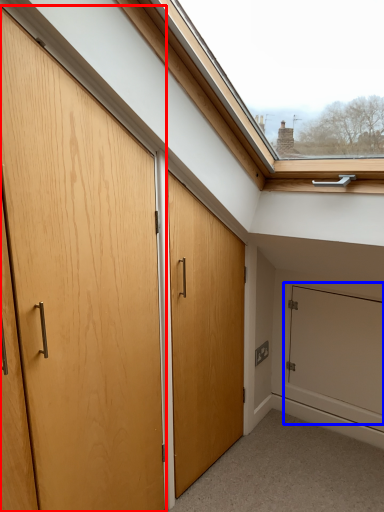
Question: Which of the following is the farthest to the observer, door (highlighted by a red box) or screen door (highlighted by a blue box)?

Choices:
 (A) door
 (B) screen door

Answer: (B)